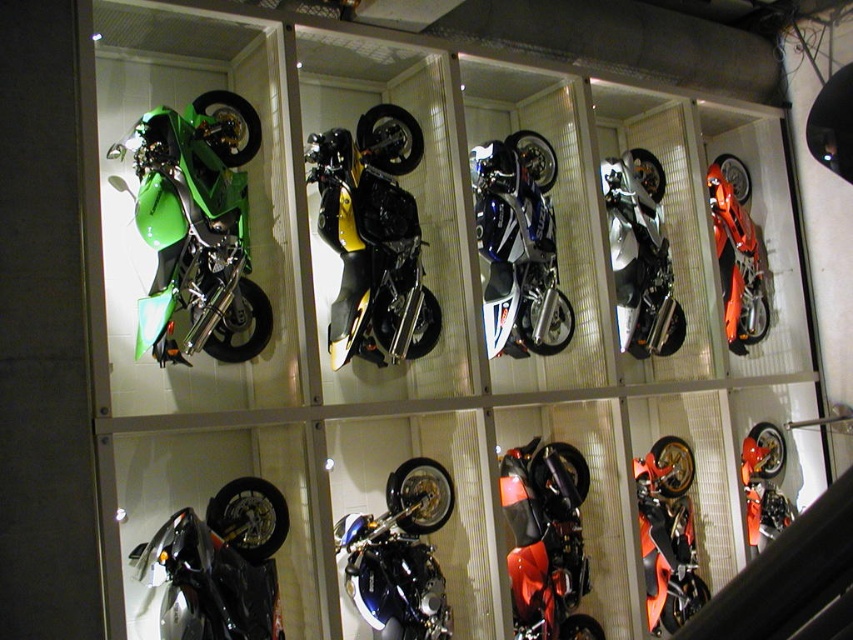
Question: Does green matte/satin motorcycle at upper left appear on the left side of white matte/silver motorcycle at center?

Choices:
 (A) yes
 (B) no

Answer: (A)

Question: Does green matte/satin motorcycle at upper left appear under white matte/silver motorcycle at center?

Choices:
 (A) yes
 (B) no

Answer: (A)

Question: Which of the following is the farthest from the observer?

Choices:
 (A) (407, 460)
 (B) (650, 532)

Answer: (B)

Question: Does glossy black motorcycle at lower left appear on the right side of silver metallic motorcycle at center-right?

Choices:
 (A) yes
 (B) no

Answer: (B)

Question: Among these objects, which one is nearest to the camera?

Choices:
 (A) shiny red motorcycle at center
 (B) yellow matte/satin motorcycle at center
 (C) white matte/silver motorcycle at center
 (D) green matte/satin motorcycle at upper left

Answer: (D)

Question: Which point is closer to the camera?

Choices:
 (A) shiny orange motorcycle at lower right
 (B) glossy black motorcycle at lower left
 (C) green matte/satin motorcycle at upper left
 (D) shiny blue motorcycle at center

Answer: (B)